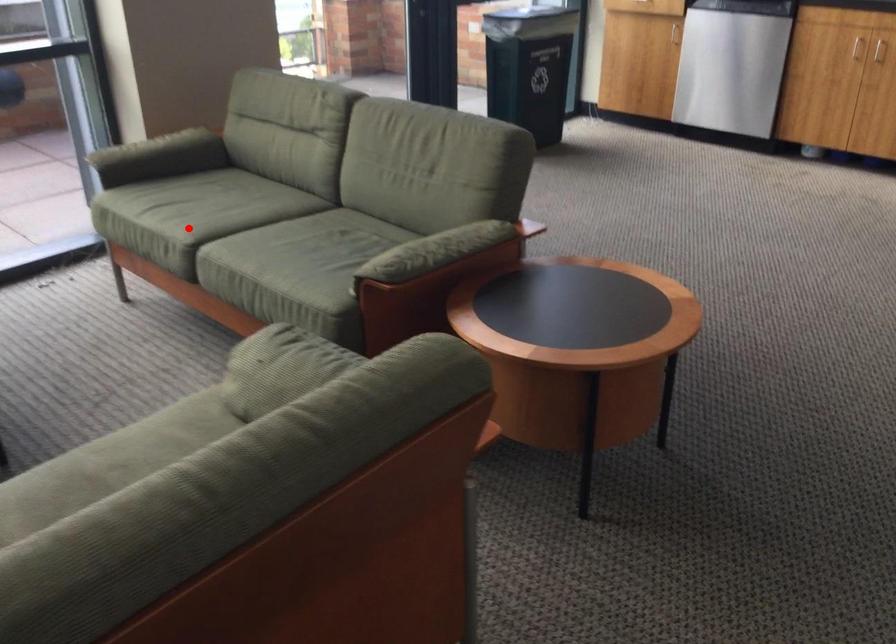
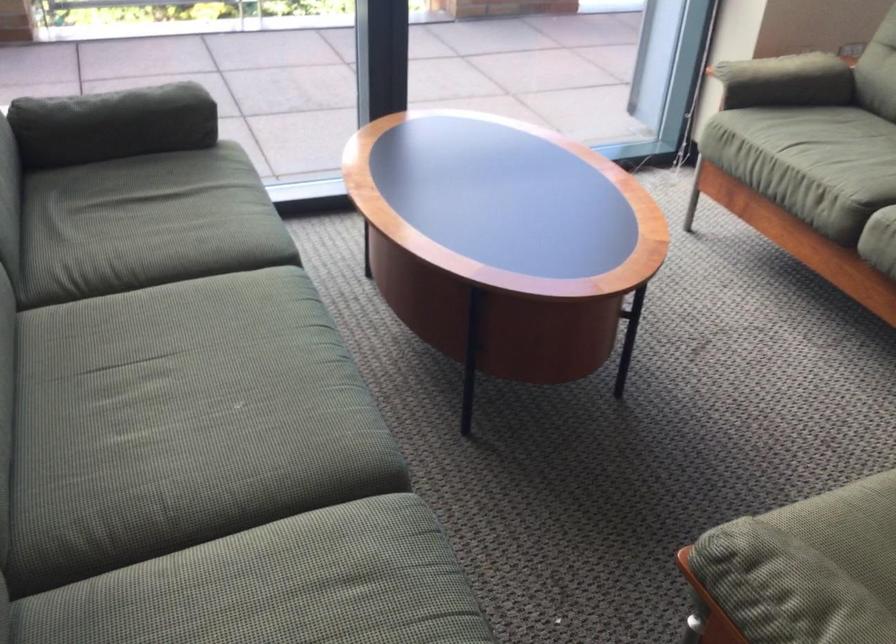
Question: I am providing you with two images of the same scene from different viewpoints. A red point is shown in image1. For the corresponding object point in image2, is it positioned nearer or farther from the camera?

Choices:
 (A) Nearer
 (B) Farther

Answer: (A)